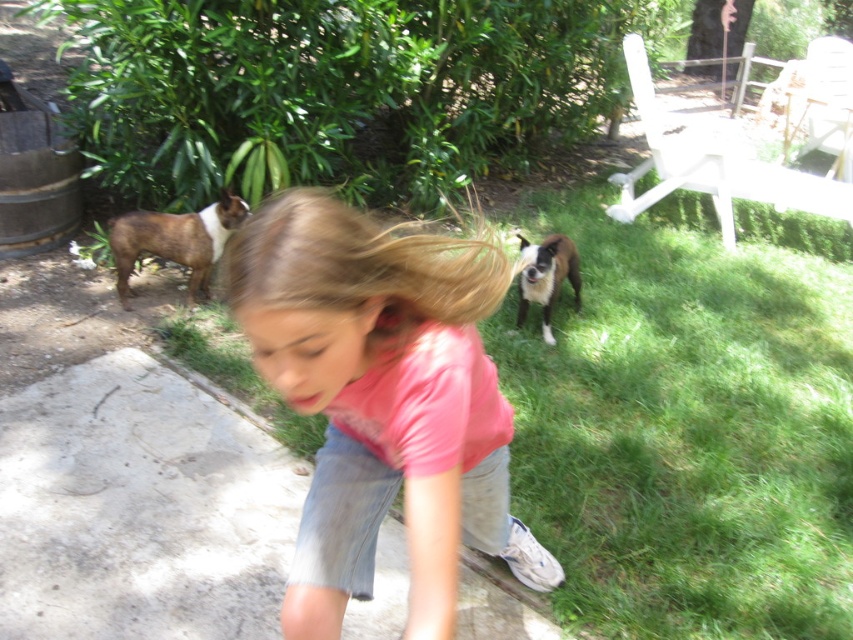
You are standing at the center of the image and want to place a new object at the point specified in the objects. Which object is located at point (712,166)?

The white plastic chair at upper right is located at point (712,166).

In the scene, you see a pink cotton shirt at center and a white plastic chair at upper right. Which object is positioned to the left of the other?

The pink cotton shirt at center is to the left of the white plastic chair at upper right.